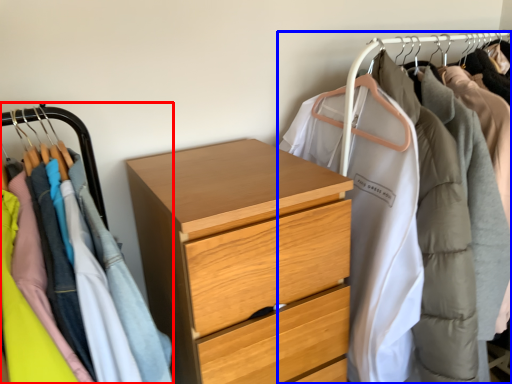
Question: Which point is closer to the camera, closet (highlighted by a red box) or closet (highlighted by a blue box)?

Choices:
 (A) closet
 (B) closet

Answer: (A)